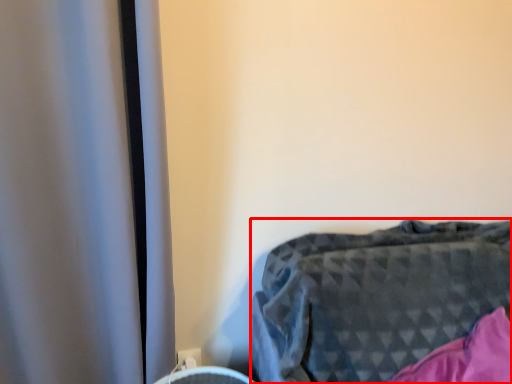
Question: From the image's perspective, what is the correct spatial relationship of furniture (annotated by the red box) in relation to electric outlet?

Choices:
 (A) above
 (B) below

Answer: (A)